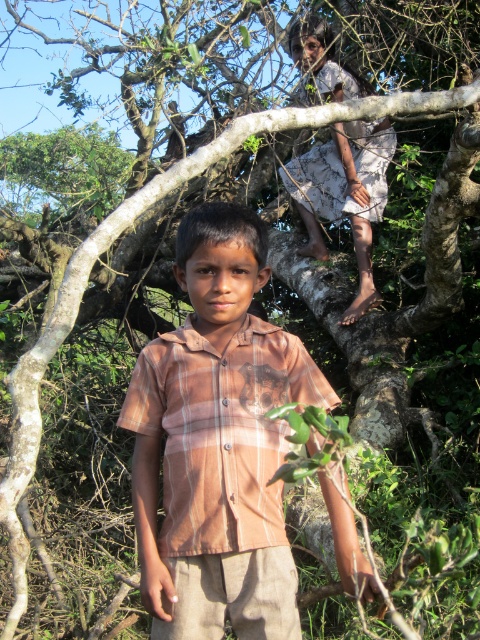
You are standing 5 feet away from the tree and want to reach the brown plaid shirt at center. Can you touch it without moving closer?

The brown plaid shirt at center is 5.56 feet away from the viewer. Since you are standing 5 feet away, you cannot reach it without moving closer as it is slightly farther than your current position.

You are a photographer trying to capture both the brown plaid shirt at center and the white cotton dress at upper center in the same frame. Which clothing item is narrower so that you can adjust your camera angle accordingly?

The brown plaid shirt at center is narrower than the white cotton dress at upper center, so you should adjust your camera angle to focus on the narrower brown plaid shirt at center first.

You are a photographer trying to capture both the brown plaid shirt at center and the white cotton dress at upper center in a single frame. Given that your camera has a 5 feet focal length, will you be able to include both subjects in the shot?

The distance between the brown plaid shirt at center and the white cotton dress at upper center is 9.18 feet. Since the camera has a 5 feet focal length, which is shorter than the distance between them, you may not be able to capture both in a single frame without moving closer or adjusting the angle.